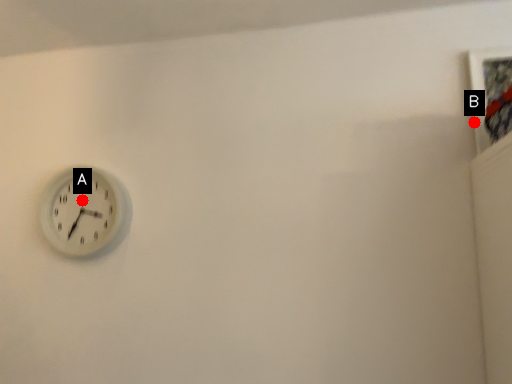
Question: Two points are circled on the image, labeled by A and B beside each circle. Which point appears closest to the camera in this image?

Choices:
 (A) A is closer
 (B) B is closer

Answer: (B)